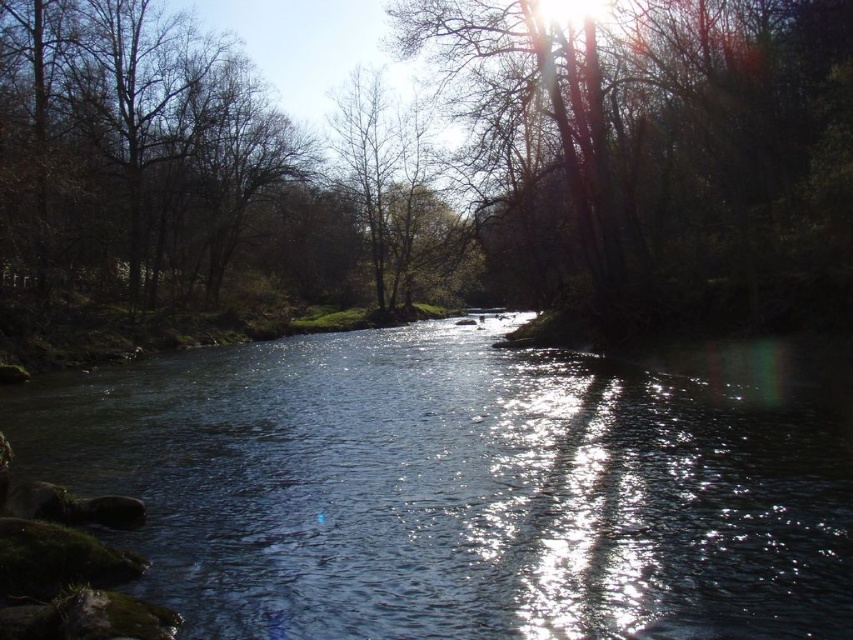
Who is more distant from viewer, (x=711, y=132) or (x=157, y=109)?

The point (x=157, y=109) is behind.

Who is positioned more to the right, smooth bark tree at center or brown leafless tree at left?

From the viewer's perspective, smooth bark tree at center appears more on the right side.

Is point (798, 147) farther from camera compared to point (193, 132)?

No, (798, 147) is closer to viewer.

This screenshot has height=640, width=853. Identify the location of smooth bark tree at center. (659, 154).

Consider the image. Between clear water at center and brown leafless tree at left, which one appears on the right side from the viewer's perspective?

Positioned to the right is clear water at center.

Is clear water at center smaller than brown leafless tree at left?

Correct, clear water at center occupies less space than brown leafless tree at left.

Is point (222, 483) more distant than point (224, 157)?

No, (222, 483) is in front of (224, 157).

Find the location of a particular element. The height and width of the screenshot is (640, 853). clear water at center is located at coordinates (468, 486).

Does point (570, 602) lie in front of point (828, 99)?

Yes, point (570, 602) is closer to viewer.

In order to click on clear water at center in this screenshot , I will do `click(468, 486)`.

Where is `clear water at center`? This screenshot has height=640, width=853. clear water at center is located at coordinates (468, 486).